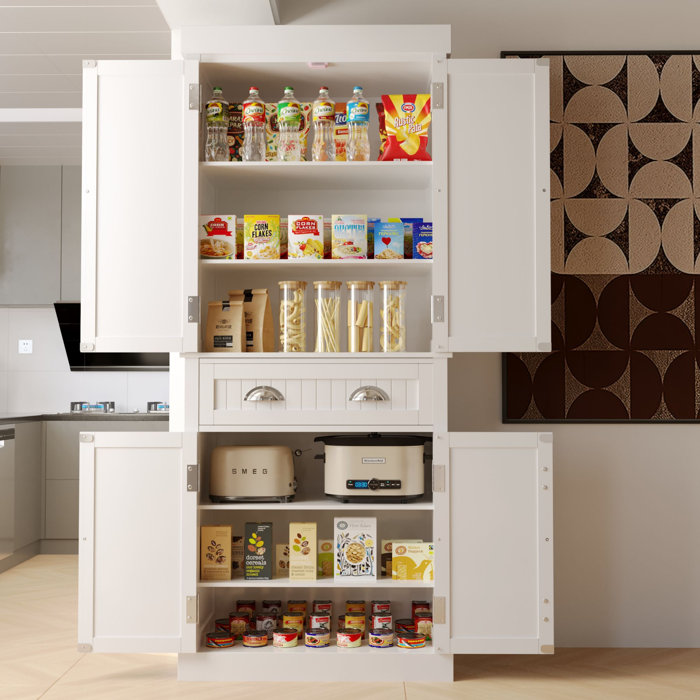
Locate an element on the screen. This screenshot has width=700, height=700. items in top shelf of cabinet is located at coordinates (404, 126), (381, 122), (353, 120), (339, 130), (322, 108), (304, 113), (287, 130), (253, 116), (234, 118), (214, 122).